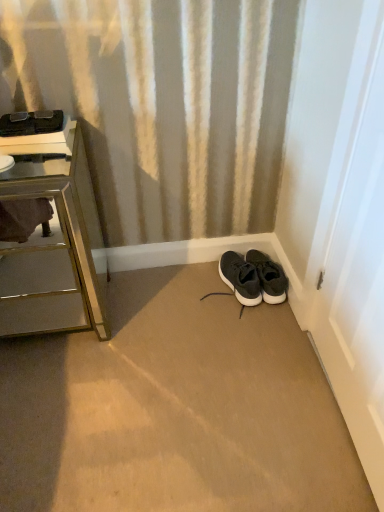
At what (x,y) coordinates should I click in order to perform the action: click on vacant space situated on the left part of matte black sneaker at lower right. Please return your answer as a coordinate pair (x, y). The height and width of the screenshot is (512, 384). Looking at the image, I should click on (196, 285).